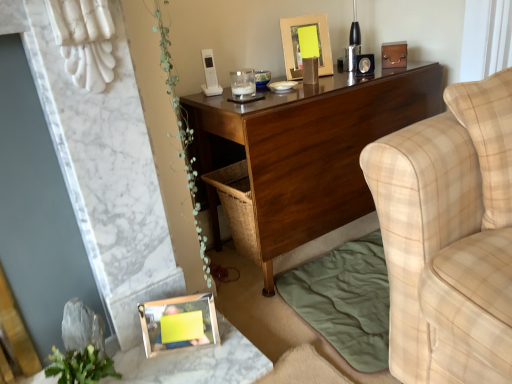
This screenshot has height=384, width=512. In order to click on unoccupied region to the right of wooden photo frame at lower left, the second picture frame in the back-to-front sequence in this screenshot , I will do `click(230, 349)`.